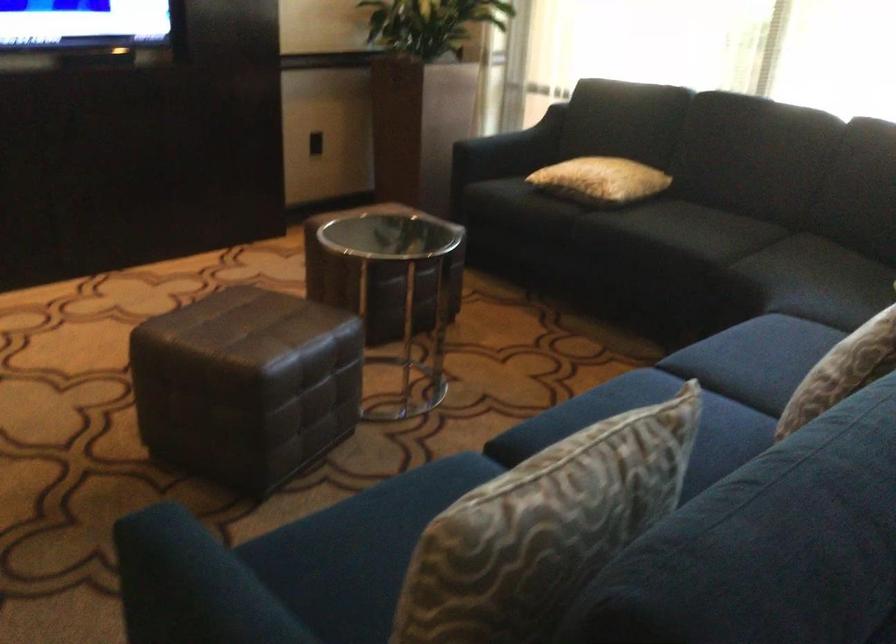
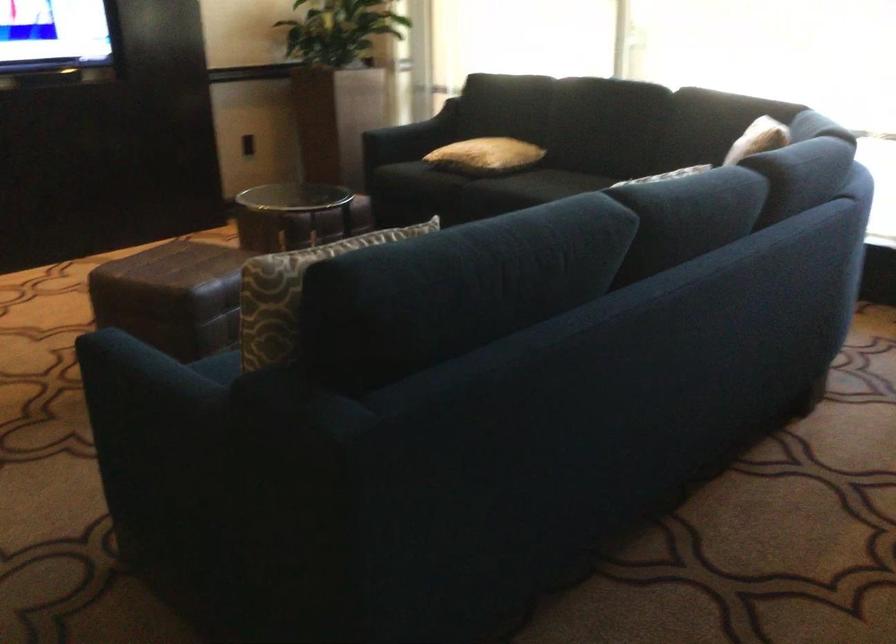
Which direction would the cameraman need to move to produce the second image?

The movement direction of the cameraman is right, backward.